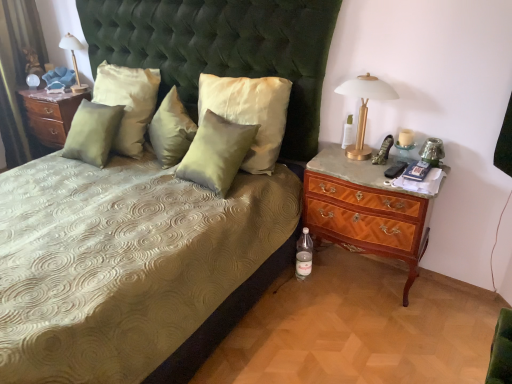
Question: Can you confirm if clear plastic bottle at lower right, the 1th bottle positioned from the left, is wider than satin green pillow at center, the 3th pillow positioned from the right?

Choices:
 (A) no
 (B) yes

Answer: (A)

Question: Can satin green pillow at center, positioned as the 3th pillow in left-to-right order, be found inside clear plastic bottle at lower right, the 1th bottle from the bottom?

Choices:
 (A) no
 (B) yes

Answer: (A)

Question: From a real-world perspective, does clear plastic bottle at lower right, the 2th bottle positioned from the top, sit lower than satin green pillow at center, positioned as the 3th pillow in left-to-right order?

Choices:
 (A) no
 (B) yes

Answer: (B)

Question: From a real-world perspective, is clear plastic bottle at lower right, arranged as the second bottle when viewed from the right, over satin green pillow at center, positioned as the 3th pillow in left-to-right order?

Choices:
 (A) no
 (B) yes

Answer: (A)

Question: Is clear plastic bottle at lower right, arranged as the second bottle when viewed from the right, outside of satin green pillow at center, positioned as the 3th pillow in left-to-right order?

Choices:
 (A) no
 (B) yes

Answer: (B)

Question: Based on their sizes in the image, would you say matte wood nightstand at left, the 1th nightstand from the left, is bigger or smaller than satin green bed at center?

Choices:
 (A) small
 (B) big

Answer: (A)

Question: Which is correct: matte wood nightstand at left, which appears as the second nightstand when ordered from the bottom, is inside satin green bed at center, or outside of it?

Choices:
 (A) inside
 (B) outside

Answer: (B)

Question: From the image's perspective, is matte wood nightstand at left, positioned as the 2th nightstand in right-to-left order, above or below satin green bed at center?

Choices:
 (A) above
 (B) below

Answer: (A)

Question: Based on their positions, is matte wood nightstand at left, which appears as the second nightstand when ordered from the bottom, located to the left or right of satin green bed at center?

Choices:
 (A) right
 (B) left

Answer: (B)

Question: Is satin green pillow at center, positioned as the 3th pillow in left-to-right order, inside the boundaries of clear glass bottle at right, marked as the 1th bottle in a top-to-bottom arrangement, or outside?

Choices:
 (A) inside
 (B) outside

Answer: (B)

Question: Considering their positions, is satin green pillow at center, positioned as the 3th pillow in left-to-right order, located in front of or behind clear glass bottle at right, marked as the 1th bottle in a top-to-bottom arrangement?

Choices:
 (A) behind
 (B) front

Answer: (A)

Question: Considering the positions of satin green pillow at center, positioned as the 3th pillow in left-to-right order, and clear glass bottle at right, which appears as the first bottle when viewed from the right, in the image, is satin green pillow at center, positioned as the 3th pillow in left-to-right order, bigger or smaller than clear glass bottle at right, which appears as the first bottle when viewed from the right,?

Choices:
 (A) small
 (B) big

Answer: (B)

Question: From a real-world perspective, relative to clear glass bottle at right, positioned as the 2th bottle in bottom-to-top order, is satin green pillow at center, the 3th pillow positioned from the right, vertically above or below?

Choices:
 (A) above
 (B) below

Answer: (B)

Question: Is gold metallic table lamp at upper right, the first bedside lamp from the front, inside the boundaries of satin green pillow at center, positioned as the 1th pillow in left-to-right order, or outside?

Choices:
 (A) outside
 (B) inside

Answer: (A)

Question: From the image's perspective, relative to satin green pillow at center, which appears as the fifth pillow when viewed from the right, is gold metallic table lamp at upper right, which ranks as the second bedside lamp in left-to-right order, above or below?

Choices:
 (A) above
 (B) below

Answer: (B)